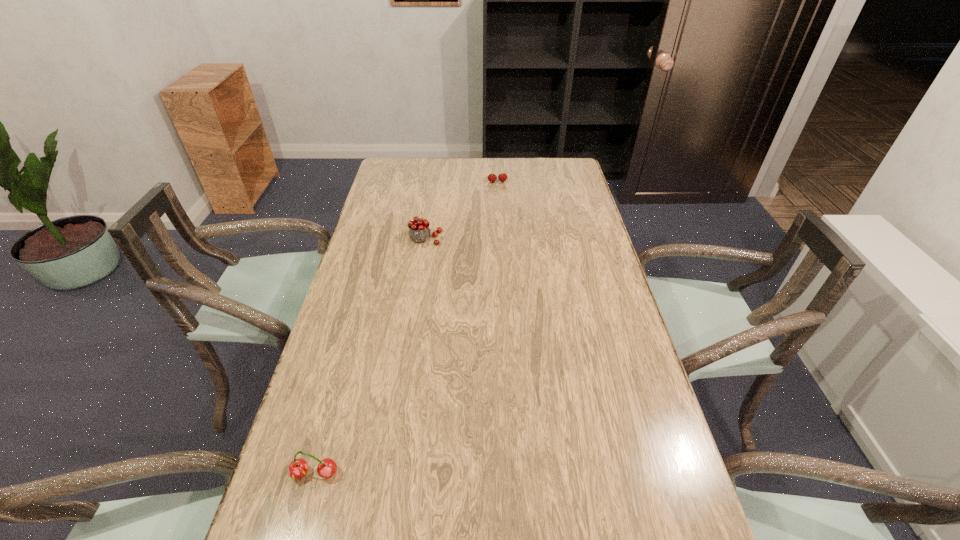
In the image, there is a desktop. Find the location of `blank space at the far edge`. blank space at the far edge is located at coordinates (451, 173).

Find the location of a particular element. The height and width of the screenshot is (540, 960). vacant region at the left edge of the desktop is located at coordinates tap(359, 288).

Image resolution: width=960 pixels, height=540 pixels. What are the coordinates of `vacant region at the right edge of the desktop` in the screenshot? It's located at (561, 220).

The height and width of the screenshot is (540, 960). I want to click on empty space between the leftmost cherry and the second farthest object, so click(370, 357).

Image resolution: width=960 pixels, height=540 pixels. Identify the location of free point between the nearest object and the farthest cherry. (406, 328).

Find the location of a particular element. The height and width of the screenshot is (540, 960). the second closest object to the rightmost cherry is located at coordinates (298, 468).

Identify which object is located as the nearest to the nearest cherry. Please provide its 2D coordinates. Your answer should be formatted as a tuple, i.e. [(x, y)], where the tuple contains the x and y coordinates of a point satisfying the conditions above.

[(419, 231)]

You are a GUI agent. You are given a task and a screenshot of the screen. Output one action in this format:
    pyautogui.click(x=<x>, y=<y>)
    Task: Click on the cherry that stands as the closest to the second nearest object
    The width and height of the screenshot is (960, 540).
    Given the screenshot: What is the action you would take?
    pyautogui.click(x=502, y=177)

Identify which cherry is located as the nearest to the rightmost cherry. Please provide its 2D coordinates. Your answer should be formatted as a tuple, i.e. [(x, y)], where the tuple contains the x and y coordinates of a point satisfying the conditions above.

[(419, 231)]